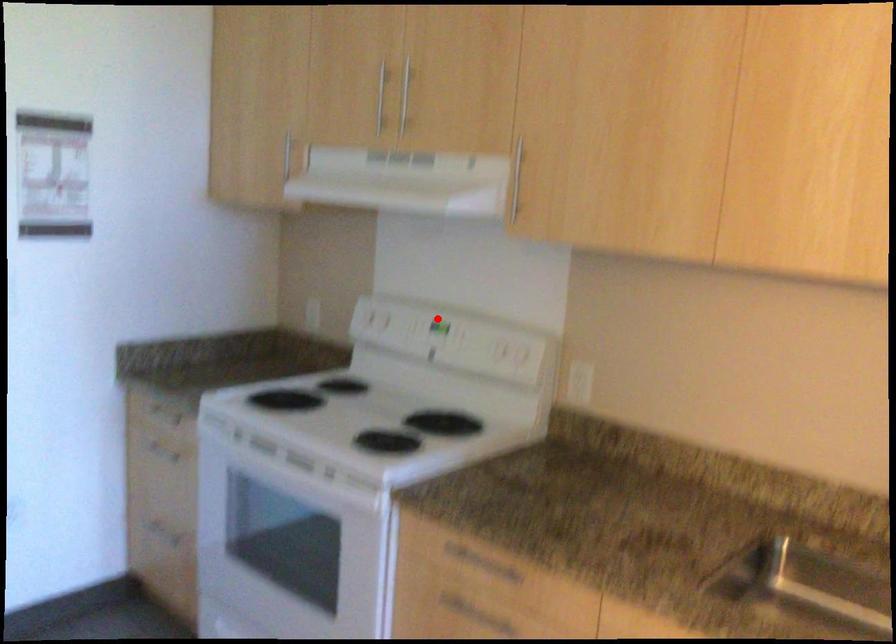
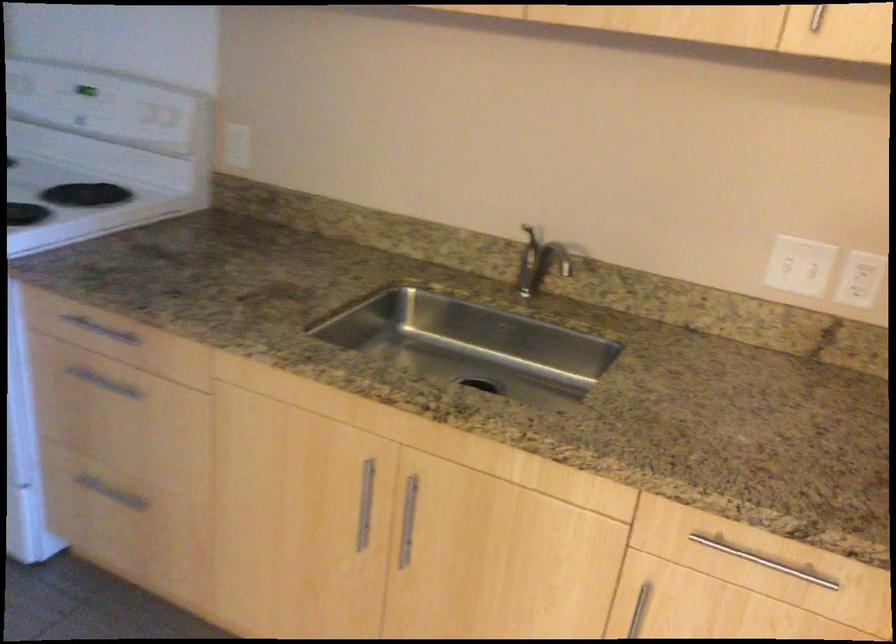
Where in the second image is the point corresponding to the highlighted location from the first image?

(85, 90)